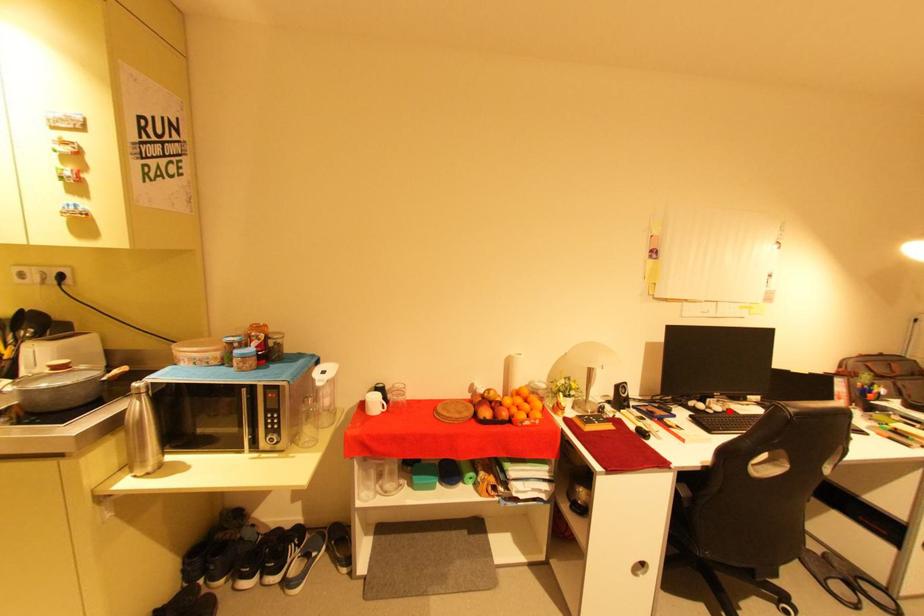
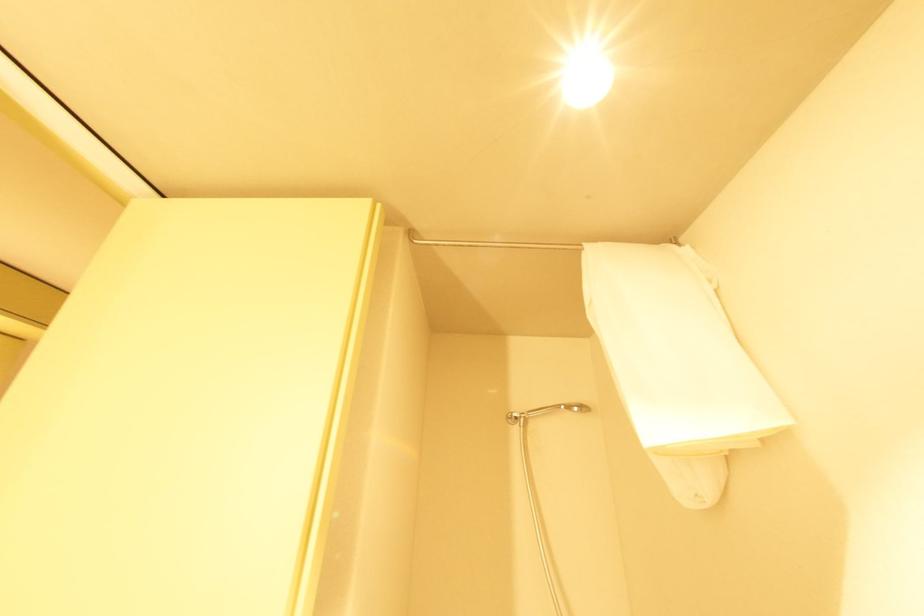
Question: I am providing you with two images of the same scene from different viewpoints. A red point is marked on the first image. Is the red point's position out of view in image 2?

Choices:
 (A) Yes
 (B) No

Answer: (A)